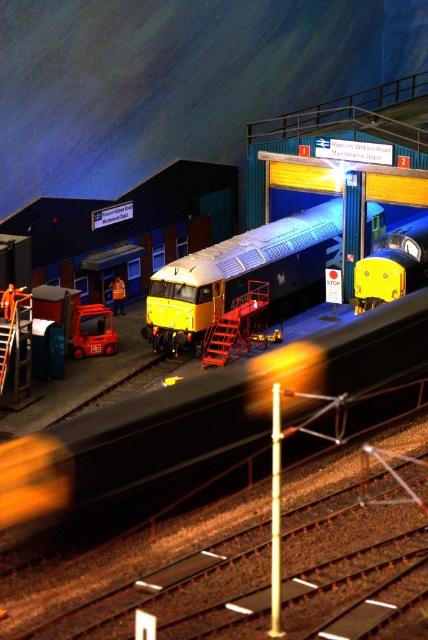
Between metallic yellow train at center and yellow plastic train at center, which one is positioned lower?

metallic yellow train at center

Does metallic yellow train at center appear on the left side of yellow plastic train at center?

Correct, you'll find metallic yellow train at center to the left of yellow plastic train at center.

Locate an element on the screen. metallic yellow train at center is located at coordinates (186, 429).

Where is `metallic yellow train at center`? metallic yellow train at center is located at coordinates (186, 429).

Is the position of metallic yellow train at center more distant than that of metallic silver train at center?

No, metallic yellow train at center is closer to the viewer.

Who is shorter, metallic yellow train at center or metallic silver train at center?

With less height is metallic yellow train at center.

Is point (386, 355) behind point (303, 230)?

That is False.

Locate an element on the screen. The height and width of the screenshot is (640, 428). metallic yellow train at center is located at coordinates (186, 429).

Between point (184, 280) and point (407, 269), which one is positioned in front?

Point (184, 280) is in front.

Does metallic silver train at center have a greater width compared to yellow plastic train at center?

Yes, metallic silver train at center is wider than yellow plastic train at center.

Is point (205, 275) behind point (398, 280)?

No, it is in front of (398, 280).

Locate an element on the screen. Image resolution: width=428 pixels, height=640 pixels. metallic silver train at center is located at coordinates (244, 275).